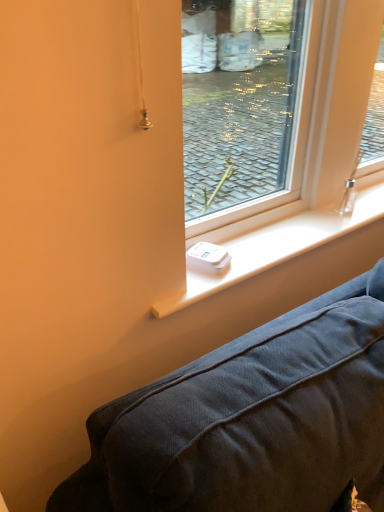
Describe the element at coordinates (303, 155) in the screenshot. I see `transparent glass window at center` at that location.

This screenshot has height=512, width=384. I want to click on transparent glass window at center, so click(x=303, y=155).

Identify the location of white plastic device at center. (276, 247).

Image resolution: width=384 pixels, height=512 pixels. Describe the element at coordinates (276, 247) in the screenshot. I see `white plastic device at center` at that location.

Locate an element on the screen. The height and width of the screenshot is (512, 384). transparent glass window at center is located at coordinates (303, 155).

Considering the relative positions of transparent glass window at center and white plastic device at center in the image provided, is transparent glass window at center to the right of white plastic device at center from the viewer's perspective?

Yes.

Considering their positions, is transparent glass window at center located in front of or behind white plastic device at center?

Visually, transparent glass window at center is located in front of white plastic device at center.

Is point (317, 237) positioned after point (266, 249)?

Yes, point (317, 237) is farther from viewer.

From the image's perspective, is transparent glass window at center located above white plastic device at center?

Yes.

From a real-world perspective, between transparent glass window at center and white plastic device at center, who is vertically higher?

A: transparent glass window at center is physically above.

Considering the sizes of objects transparent glass window at center and white plastic device at center in the image provided, who is thinner, transparent glass window at center or white plastic device at center?

transparent glass window at center.

Can you confirm if transparent glass window at center is taller than white plastic device at center?

Indeed, transparent glass window at center has a greater height compared to white plastic device at center.

Based on their sizes in the image, would you say transparent glass window at center is bigger or smaller than white plastic device at center?

In the image, transparent glass window at center appears to be larger than white plastic device at center.

Would you say transparent glass window at center contains white plastic device at center?

No, white plastic device at center is not inside transparent glass window at center.

Can you see transparent glass window at center touching white plastic device at center?

Yes, transparent glass window at center is in contact with white plastic device at center.

Could you tell me if transparent glass window at center is facing white plastic device at center?

Yes, transparent glass window at center is turned towards white plastic device at center.

How many degrees apart are the facing directions of transparent glass window at center and white plastic device at center?

The angle between the facing direction of transparent glass window at center and the facing direction of white plastic device at center is 0.801 degrees.

Identify the location of window sill lying behind the transparent glass window at center. The height and width of the screenshot is (512, 384). (276, 247).

Considering the relative positions of white plastic device at center and transparent glass window at center in the image provided, is white plastic device at center to the right of transparent glass window at center from the viewer's perspective?

No, white plastic device at center is not to the right of transparent glass window at center.

Does white plastic device at center come in front of transparent glass window at center?

That is False.

Does point (229, 277) appear closer or farther from the camera than point (353, 119)?

Point (229, 277) is positioned closer to the camera compared to point (353, 119).

From the image's perspective, which one is positioned lower, white plastic device at center or transparent glass window at center?

white plastic device at center.

From a real-world perspective, which object rests below the other?

white plastic device at center is physically lower.

Considering the sizes of objects white plastic device at center and transparent glass window at center in the image provided, who is thinner, white plastic device at center or transparent glass window at center?

transparent glass window at center is thinner.

Which of these two, white plastic device at center or transparent glass window at center, stands taller?

transparent glass window at center is taller.

Who is smaller, white plastic device at center or transparent glass window at center?

Smaller between the two is white plastic device at center.

Could transparent glass window at center be considered to be inside white plastic device at center?

No.

Is white plastic device at center directly adjacent to transparent glass window at center?

Absolutely, white plastic device at center is next to and touching transparent glass window at center.

Could you tell me if white plastic device at center is facing transparent glass window at center?

No, white plastic device at center is not turned towards transparent glass window at center.

In the scene shown: How distant is white plastic device at center from transparent glass window at center?

They are 3.89 inches apart.

Image resolution: width=384 pixels, height=512 pixels. What are the coordinates of `window screen in front of the white plastic device at center` in the screenshot? It's located at (303, 155).

I want to click on window sill below the transparent glass window at center (from a real-world perspective), so click(276, 247).

This screenshot has height=512, width=384. In order to click on window screen in front of the white plastic device at center in this screenshot , I will do `click(303, 155)`.